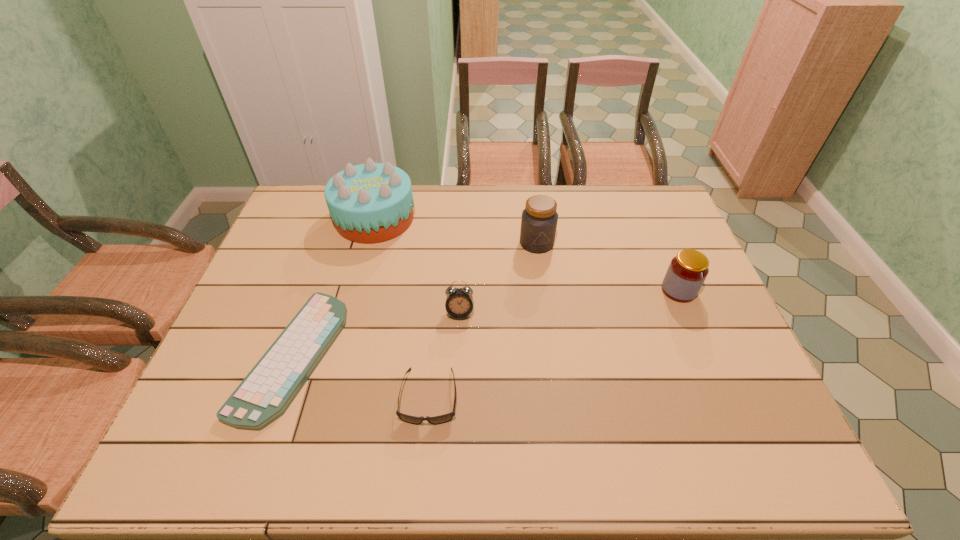
The height and width of the screenshot is (540, 960). I want to click on free spot located 0.340m on the front of the third tallest object, so click(732, 415).

Identify the location of free space located 0.380m on the face of the alarm clock. (454, 461).

At what (x,y) coordinates should I click in order to perform the action: click on vacant space located on the front-facing side of the sunglasses. Please return your answer as a coordinate pair (x, y). This screenshot has height=540, width=960. Looking at the image, I should click on (422, 467).

The image size is (960, 540). Find the location of `vacant space located 0.360m on the right of the shortest object`. vacant space located 0.360m on the right of the shortest object is located at coordinates (478, 356).

Identify the location of object that is at the far edge. (369, 203).

Find the location of a particular element. The width and height of the screenshot is (960, 540). object located in the near edge section of the desktop is located at coordinates click(x=265, y=394).

Where is `object present at the left edge`? Image resolution: width=960 pixels, height=540 pixels. object present at the left edge is located at coordinates [265, 394].

Identify the location of object that is positioned at the right edge. The height and width of the screenshot is (540, 960). (687, 271).

Locate an element on the screen. This screenshot has width=960, height=540. object that is at the near left corner is located at coordinates (265, 394).

Locate an element on the screen. Image resolution: width=960 pixels, height=540 pixels. free region at the far edge of the desktop is located at coordinates [611, 201].